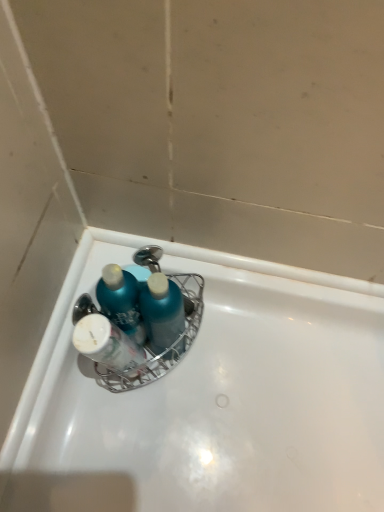
What do you see at coordinates (211, 398) in the screenshot? I see `white glossy bathtub at center` at bounding box center [211, 398].

Describe the element at coordinates (121, 301) in the screenshot. This screenshot has height=512, width=384. I see `blue glossy bottle at upper center` at that location.

You are a GUI agent. You are given a task and a screenshot of the screen. Output one action in this format:
    pyautogui.click(x=<x>, y=<y>)
    Task: Click on the white glossy bathtub at center
    
    Given the screenshot: What is the action you would take?
    pyautogui.click(x=211, y=398)

What's the angular difference between white glossy bathtub at center and blue glossy bottle at upper center's facing directions?

1.5 degrees.

Based on their positions, is white glossy bathtub at center located to the left or right of blue glossy bottle at upper center?

Clearly, white glossy bathtub at center is on the right of blue glossy bottle at upper center in the image.

Can you confirm if white glossy bathtub at center is taller than blue glossy bottle at upper center?

Incorrect, the height of white glossy bathtub at center is not larger of that of blue glossy bottle at upper center.

Choose the correct answer: Is white glossy bottle at center inside blue glossy bottle at upper center or outside it?

white glossy bottle at center is spatially situated outside blue glossy bottle at upper center.

Image resolution: width=384 pixels, height=512 pixels. I want to click on toiletry below the blue glossy bottle at upper center (from the image's perspective), so click(x=106, y=344).

From a real-world perspective, between white glossy bottle at center and blue glossy bottle at upper center, who is vertically lower?

blue glossy bottle at upper center, from a real-world perspective.

Which is more to the left, white glossy bottle at center or blue glossy bottle at upper center?

Positioned to the left is white glossy bottle at center.

Does point (119, 342) lie behind point (117, 434)?

No, it is in front of (117, 434).

Based on the photo, are white glossy bottle at center and white glossy bathtub at center making contact?

No.

Can you confirm if white glossy bottle at center is bigger than white glossy bathtub at center?

Actually, white glossy bottle at center might be smaller than white glossy bathtub at center.

From a real-world perspective, does white glossy bottle at center sit lower than white glossy bathtub at center?

No, from a real-world perspective, white glossy bottle at center is not below white glossy bathtub at center.

From the image's perspective, does blue glossy bottle at upper center appear lower than white glossy bottle at center?

No.

Find the location of a particular element. The image size is (384, 512). toiletry lying on the left of blue glossy bottle at upper center is located at coordinates (106, 344).

Considering the relative positions of blue glossy bottle at upper center and white glossy bottle at center in the image provided, is blue glossy bottle at upper center in front of white glossy bottle at center?

No, it is behind white glossy bottle at center.

Which of these two, blue glossy bottle at upper center or white glossy bathtub at center, is smaller?

With smaller size is blue glossy bottle at upper center.

Can you confirm if blue glossy bottle at upper center is wider than white glossy bathtub at center?

No.

How many degrees apart are the facing directions of blue glossy bottle at upper center and white glossy bathtub at center?

They differ by 1.5 degrees in their facing directions.

Which point is more forward, (110, 317) or (183, 398)?

The point (110, 317) is closer to the camera.

There is a white glossy bathtub at center. Where is `toiletry above it (from a real-world perspective)`? toiletry above it (from a real-world perspective) is located at coordinates point(106,344).

Is white glossy bathtub at center looking in the opposite direction of white glossy bottle at center?

No, white glossy bottle at center is not at the back of white glossy bathtub at center.

Considering the sizes of white glossy bathtub at center and white glossy bottle at center in the image, is white glossy bathtub at center bigger or smaller than white glossy bottle at center?

Clearly, white glossy bathtub at center is larger in size than white glossy bottle at center.

Based on the photo, in terms of width, does white glossy bathtub at center look wider or thinner when compared to white glossy bottle at center?

white glossy bathtub at center is wider than white glossy bottle at center.

Where is `mouthwash that appears above the white glossy bathtub at center (from a real-world perspective)`? The image size is (384, 512). mouthwash that appears above the white glossy bathtub at center (from a real-world perspective) is located at coordinates (121, 301).

Identify the location of mouthwash to the right of white glossy bottle at center. (121, 301).

Estimate the real-world distances between objects in this image. Which object is closer to white glossy bathtub at center, blue glossy bottle at upper center or white glossy bottle at center?

white glossy bottle at center is closer to white glossy bathtub at center.

When comparing their distances from white glossy bottle at center, does white glossy bathtub at center or blue glossy bottle at upper center seem closer?

Based on the image, blue glossy bottle at upper center appears to be nearer to white glossy bottle at center.

Based on the photo, considering their positions, is white glossy bottle at center positioned closer to white glossy bathtub at center than blue glossy bottle at upper center?

white glossy bottle at center.

From the picture: Estimate the real-world distances between objects in this image. Which object is closer to white glossy bottle at center, blue glossy bottle at upper center or white glossy bathtub at center?

blue glossy bottle at upper center.

Which object lies nearer to the anchor point blue glossy bottle at upper center, white glossy bathtub at center or white glossy bottle at center?

white glossy bottle at center.

Based on their spatial positions, is white glossy bottle at center or white glossy bathtub at center further from blue glossy bottle at upper center?

Among the two, white glossy bathtub at center is located further to blue glossy bottle at upper center.

In order to click on mouthwash situated between white glossy bottle at center and white glossy bathtub at center from left to right in this screenshot , I will do `click(121, 301)`.